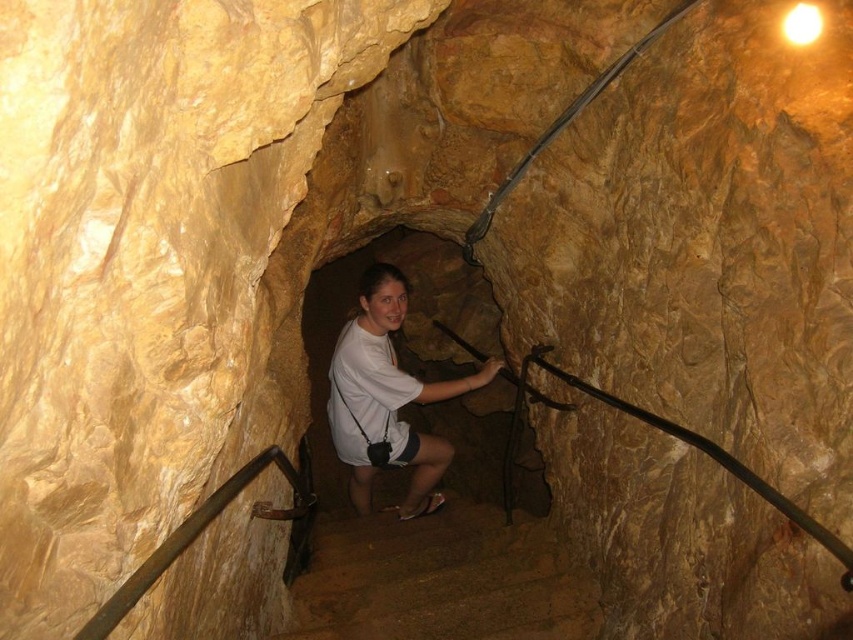
You are the person in the tunnel and want to move towards the exit located at point (300, 598). You are currently at point (393, 269). Is the exit in front of you or behind you?

The exit at point (300, 598) is in front of you because it is positioned in front of your current location at point (393, 269) according to the spatial description.

You are a tour guide leading a group through a cave tunnel. You notice the brown stone stairs at center and the white matte shirt at center. Which object appears larger in the image?

The white matte shirt at center appears larger than the brown stone stairs at center because the brown stone stairs at center is smaller than the white matte shirt at center according to the description.